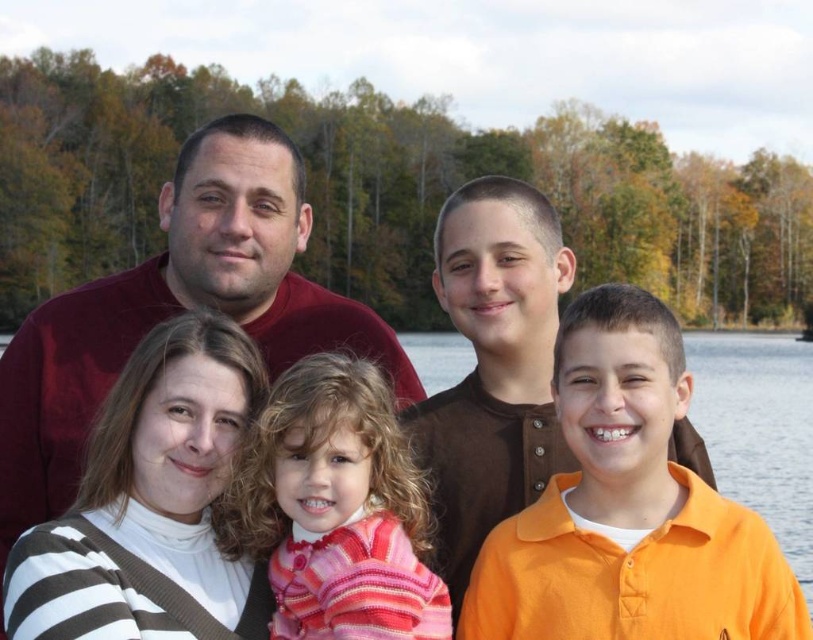
Who is taller, striped knit sweater at center or brown cotton shirt at center?

Standing taller between the two is brown cotton shirt at center.

Identify the location of striped knit sweater at center. This screenshot has height=640, width=813. (337, 508).

Is velvet maroon sweater at upper left below orange shirt at center?

Yes, velvet maroon sweater at upper left is below orange shirt at center.

Is point (324, 298) closer to viewer compared to point (720, 417)?

Yes, point (324, 298) is closer to viewer.

You are a GUI agent. You are given a task and a screenshot of the screen. Output one action in this format:
    pyautogui.click(x=<x>, y=<y>)
    Task: Click on the velvet maroon sweater at upper left
    
    Given the screenshot: What is the action you would take?
    pyautogui.click(x=176, y=308)

Can you confirm if white striped sweater at lower left is bigger than brown cotton shirt at center?

No, white striped sweater at lower left is not bigger than brown cotton shirt at center.

Does white striped sweater at lower left have a greater height compared to brown cotton shirt at center?

Incorrect, white striped sweater at lower left's height is not larger of brown cotton shirt at center's.

You are a GUI agent. You are given a task and a screenshot of the screen. Output one action in this format:
    pyautogui.click(x=<x>, y=<y>)
    Task: Click on the white striped sweater at lower left
    This screenshot has width=813, height=640.
    Given the screenshot: What is the action you would take?
    pyautogui.click(x=151, y=502)

Find the location of `white striped sweater at lower left`. white striped sweater at lower left is located at coordinates (151, 502).